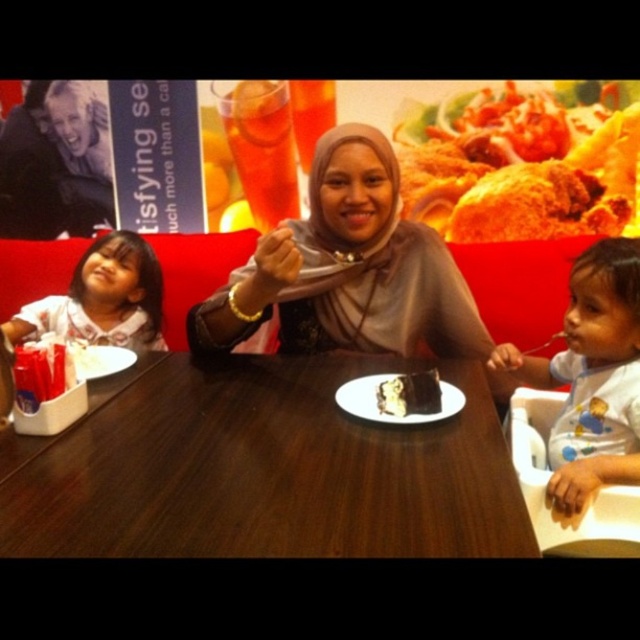
Can you confirm if matte brown hijab at center is positioned below white ceramic plate at center?

Incorrect, matte brown hijab at center is not positioned below white ceramic plate at center.

This screenshot has width=640, height=640. I want to click on matte brown hijab at center, so click(x=348, y=273).

Which is in front, point (372, 129) or point (362, 412)?

Point (362, 412) is in front.

Where is `matte brown hijab at center`? This screenshot has height=640, width=640. matte brown hijab at center is located at coordinates (348, 273).

Between wooden table at center and matte brown hijab at center, which one has less height?

With less height is wooden table at center.

Between wooden table at center and matte brown hijab at center, which one appears on the right side from the viewer's perspective?

Positioned to the right is matte brown hijab at center.

Which is behind, point (154, 480) or point (346, 257)?

Positioned behind is point (346, 257).

The image size is (640, 640). Identify the location of wooden table at center. (260, 468).

Can you confirm if smooth white shirt at right is wider than white shirt at left?

Incorrect, smooth white shirt at right's width does not surpass white shirt at left's.

Is the position of smooth white shirt at right more distant than that of white shirt at left?

No, smooth white shirt at right is closer to the viewer.

This screenshot has height=640, width=640. What do you see at coordinates (592, 378) in the screenshot? I see `smooth white shirt at right` at bounding box center [592, 378].

Identify the location of smooth white shirt at right. (592, 378).